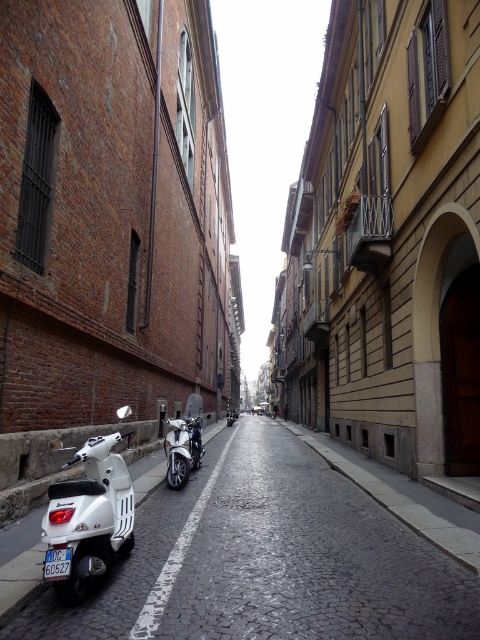
Can you confirm if white glossy scooter at lower left is positioned to the right of white matte scooter at lower left?

Correct, you'll find white glossy scooter at lower left to the right of white matte scooter at lower left.

Does point (305, 584) come behind point (63, 538)?

Yes, it is behind point (63, 538).

Find the location of a particular element. The width and height of the screenshot is (480, 640). white glossy scooter at lower left is located at coordinates (269, 560).

Measure the distance between white matte scooter at lower left and blue plastic license plate at center.

They are 10.37 inches apart.

Is white matte scooter at lower left below blue plastic license plate at center?

No.

The width and height of the screenshot is (480, 640). What are the coordinates of `white matte scooter at lower left` in the screenshot? It's located at (87, 518).

Which is below, white glossy scooter at lower left or shiny chrome motorcycle at center?

white glossy scooter at lower left is below.

At what (x,y) coordinates should I click in order to perform the action: click on white glossy scooter at lower left. Please return your answer as a coordinate pair (x, y). The width and height of the screenshot is (480, 640). Looking at the image, I should click on (269, 560).